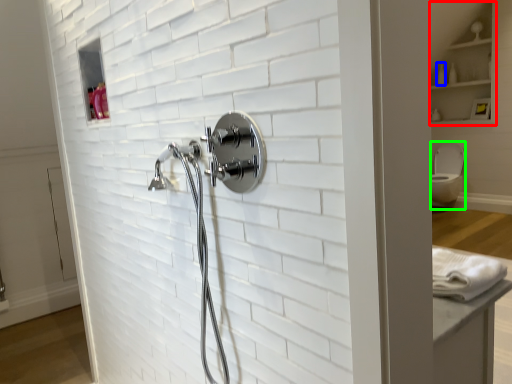
Question: Which object is the closest to the cabinet (highlighted by a red box)? Choose among these: toiletry (highlighted by a blue box) or toilet bowl (highlighted by a green box).

Choices:
 (A) toiletry
 (B) toilet bowl

Answer: (A)